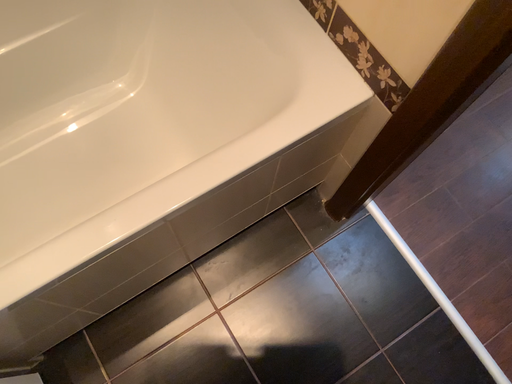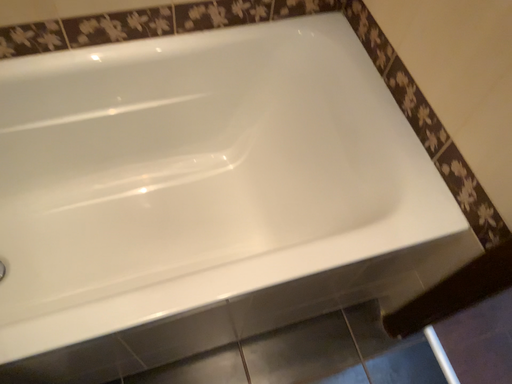
Question: Which way did the camera rotate in the video?

Choices:
 (A) rotated upward
 (B) rotated downward

Answer: (A)